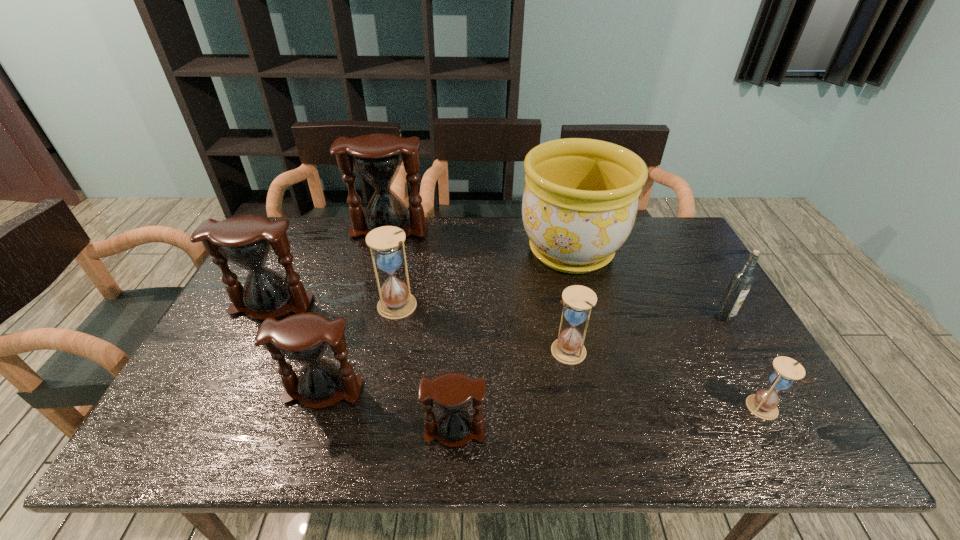
Locate an element on the screen. vacant point located 0.200m on the front of the second farthest white hourglass is located at coordinates (585, 440).

Where is `free location located 0.220m on the left of the second smallest brown hourglass`? This screenshot has height=540, width=960. free location located 0.220m on the left of the second smallest brown hourglass is located at coordinates (193, 391).

Locate an element on the screen. This screenshot has height=540, width=960. vacant space located on the left of the rightmost white hourglass is located at coordinates (608, 408).

Where is `free space located on the back of the rightmost brown hourglass`? free space located on the back of the rightmost brown hourglass is located at coordinates (461, 310).

Identify the location of hourglass that is at the far edge. (377, 157).

Locate an element on the screen. flowerpot located in the far edge section of the desktop is located at coordinates (580, 201).

Where is `object that is at the left edge`? object that is at the left edge is located at coordinates (246, 241).

The height and width of the screenshot is (540, 960). What are the coordinates of `vodka at the right edge` in the screenshot? It's located at (742, 280).

What are the coordinates of `hourglass at the right edge` in the screenshot? It's located at (763, 404).

I want to click on object located in the near right corner section of the desktop, so click(x=763, y=404).